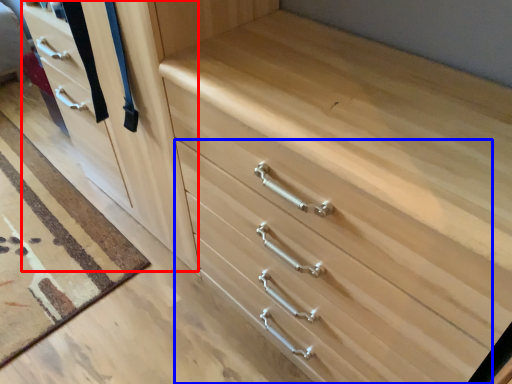
Question: Among these objects, which one is farthest to the camera, door (highlighted by a red box) or drawer (highlighted by a blue box)?

Choices:
 (A) door
 (B) drawer

Answer: (A)